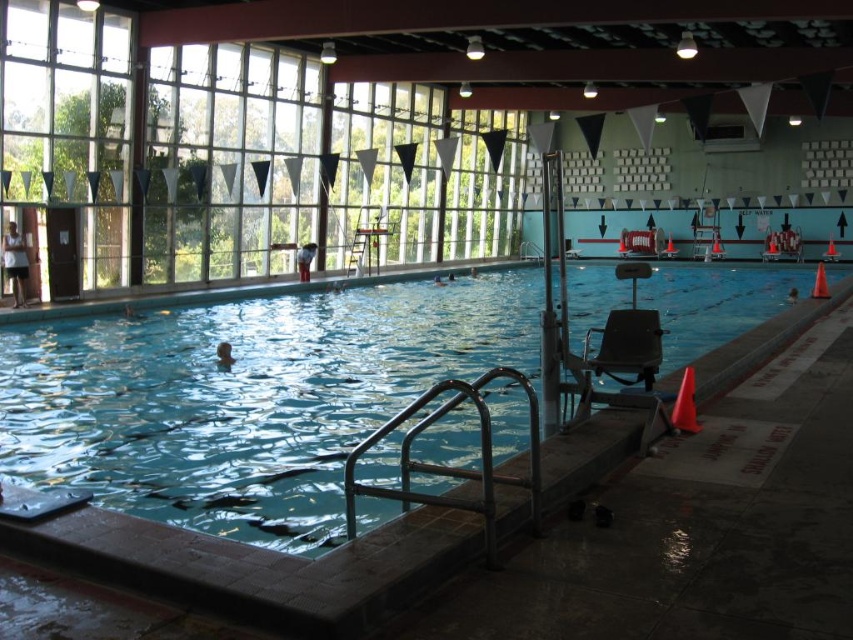
Can you confirm if clear blue water at center is taller than brown skin at center?

Correct, clear blue water at center is much taller as brown skin at center.

Which is more to the right, clear blue water at center or brown skin at center?

From the viewer's perspective, clear blue water at center appears more on the right side.

What do you see at coordinates (245, 397) in the screenshot? The image size is (853, 640). I see `clear blue water at center` at bounding box center [245, 397].

Locate an element on the screen. The image size is (853, 640). clear blue water at center is located at coordinates (245, 397).

Which is more to the left, white cotton shirt at left or smooth skin person at center?

Positioned to the left is white cotton shirt at left.

From the picture: Is white cotton shirt at left above smooth skin person at center?

No.

Identify the location of white cotton shirt at left. Image resolution: width=853 pixels, height=640 pixels. (15, 262).

The height and width of the screenshot is (640, 853). I want to click on white cotton shirt at left, so click(15, 262).

Is point (7, 253) positioned after point (308, 253)?

No, (7, 253) is closer to viewer.

Who is positioned more to the right, white cotton shirt at left or matte black swimmer at center?

matte black swimmer at center is more to the right.

Which is behind, point (4, 272) or point (306, 268)?

Positioned behind is point (306, 268).

This screenshot has width=853, height=640. Find the location of `white cotton shirt at left`. white cotton shirt at left is located at coordinates (15, 262).